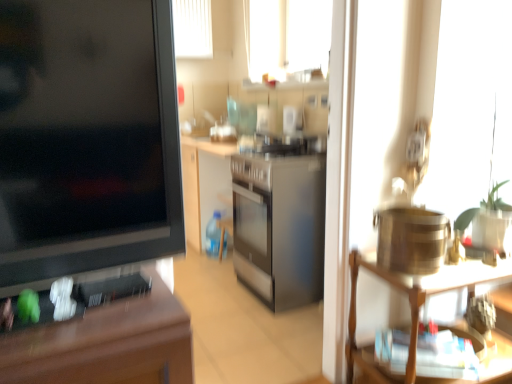
Question: Relative to wooden shelf at right, is wooden desk at left in front or behind?

Choices:
 (A) behind
 (B) front

Answer: (B)

Question: From the image's perspective, is wooden desk at left above or below wooden shelf at right?

Choices:
 (A) above
 (B) below

Answer: (A)

Question: Visually, is wooden desk at left positioned to the left or to the right of wooden shelf at right?

Choices:
 (A) right
 (B) left

Answer: (B)

Question: In the image, is wooden shelf at right on the left side or the right side of wooden desk at left?

Choices:
 (A) right
 (B) left

Answer: (A)

Question: From a real-world perspective, is wooden shelf at right positioned above or below wooden desk at left?

Choices:
 (A) below
 (B) above

Answer: (A)

Question: Choose the correct answer: Is wooden shelf at right inside wooden desk at left or outside it?

Choices:
 (A) inside
 (B) outside

Answer: (B)

Question: Is point (496, 266) closer or farther from the camera than point (41, 109)?

Choices:
 (A) farther
 (B) closer

Answer: (A)